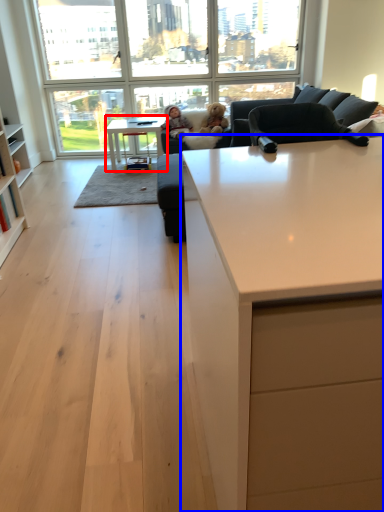
Question: Which of the following is the closest to the observer, table (highlighted by a red box) or countertop (highlighted by a blue box)?

Choices:
 (A) table
 (B) countertop

Answer: (B)